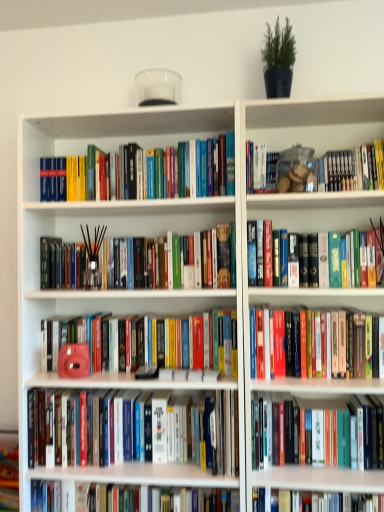
Question: Which direction should I rotate to look at matte pink camera at center, the 5th book viewed from the top?

Choices:
 (A) right
 (B) left

Answer: (B)

Question: Is matte pink camera at center, the 5th book viewed from the top, taller than black matte incense sticks at center, the 3th book when ordered from top to bottom?

Choices:
 (A) yes
 (B) no

Answer: (B)

Question: Can we say matte pink camera at center, which is the 4th book in bottom-to-top order, lies outside black matte incense sticks at center, the 3th book when ordered from top to bottom?

Choices:
 (A) yes
 (B) no

Answer: (A)

Question: Can you confirm if matte pink camera at center, which is the 4th book in bottom-to-top order, is shorter than black matte incense sticks at center, the 3th book when ordered from top to bottom?

Choices:
 (A) no
 (B) yes

Answer: (B)

Question: From a real-world perspective, is matte pink camera at center, the 5th book viewed from the top, positioned over black matte incense sticks at center, acting as the 6th book starting from the bottom, based on gravity?

Choices:
 (A) no
 (B) yes

Answer: (A)

Question: Is matte pink camera at center, which is the 4th book in bottom-to-top order, looking in the opposite direction of black matte incense sticks at center, acting as the 6th book starting from the bottom?

Choices:
 (A) yes
 (B) no

Answer: (B)

Question: Can you confirm if matte pink camera at center, which is the 4th book in bottom-to-top order, is bigger than black matte incense sticks at center, the 3th book when ordered from top to bottom?

Choices:
 (A) no
 (B) yes

Answer: (A)

Question: Is white glossy book at center, which is the first book in bottom-to-top order, not near matte pink camera at center, acting as the 6th book starting from the top?

Choices:
 (A) no
 (B) yes

Answer: (A)

Question: Does white glossy book at center, which is the first book in bottom-to-top order, have a greater height compared to matte pink camera at center, acting as the 6th book starting from the top?

Choices:
 (A) no
 (B) yes

Answer: (A)

Question: Considering the relative sizes of white glossy book at center, which is the 8th book in top-to-bottom order, and matte pink camera at center, acting as the 6th book starting from the top, in the image provided, is white glossy book at center, which is the 8th book in top-to-bottom order, bigger than matte pink camera at center, acting as the 6th book starting from the top,?

Choices:
 (A) yes
 (B) no

Answer: (B)

Question: Does white glossy book at center, which is the 8th book in top-to-bottom order, turn towards matte pink camera at center, which is counted as the 3th book, starting from the bottom?

Choices:
 (A) yes
 (B) no

Answer: (B)

Question: Is matte pink camera at center, which is counted as the 3th book, starting from the bottom, inside white glossy book at center, which is the first book in bottom-to-top order?

Choices:
 (A) no
 (B) yes

Answer: (A)

Question: Is white glossy book at center, which is the 8th book in top-to-bottom order, positioned with its back to matte pink camera at center, acting as the 6th book starting from the top?

Choices:
 (A) no
 (B) yes

Answer: (A)

Question: Are matte pink camera at center, which is the 4th book in bottom-to-top order, and hardcover book at center, marked as the 7th book in a bottom-to-top arrangement, far apart?

Choices:
 (A) yes
 (B) no

Answer: (B)